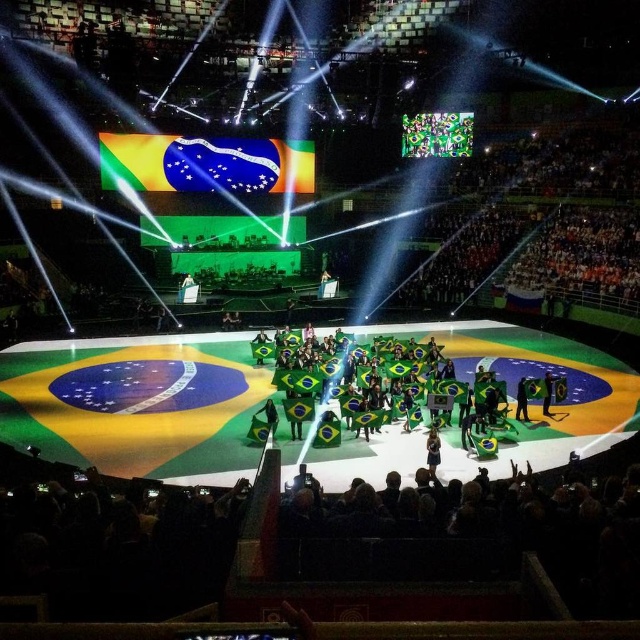
You are an event organizer planning to place a 1.2 meter tall trophy on the stage. Considering the green fabric person at center and the green fabric flag at center, which object is more suitable to place the trophy next to in terms of size compatibility?

The green fabric flag at center is larger than the green fabric person at center, so placing the trophy next to the green fabric flag at center would be more suitable due to its larger size.

You are a photographer at the event and need to capture a clear photo of both the green fabric person at center and the green fabric flag at center. Given that your camera can only focus on one subject at a time, which subject should you focus on first to ensure the thinner one is in focus?

The green fabric person at center is thinner than the green fabric flag at center, so you should focus on the green fabric person at center first to ensure its details are captured clearly.